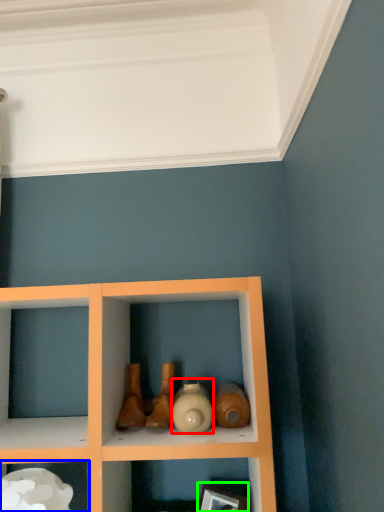
Question: Which is farther away from bottle (highlighted by a red box)? shelf (highlighted by a blue box) or picture frame (highlighted by a green box)?

Choices:
 (A) shelf
 (B) picture frame

Answer: (A)